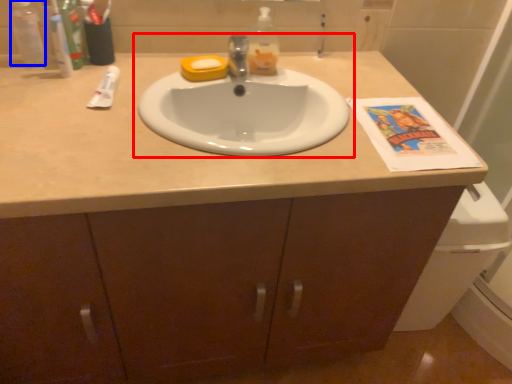
Question: Which of the following is the closest to the observer, sink (highlighted by a red box) or bottle (highlighted by a blue box)?

Choices:
 (A) sink
 (B) bottle

Answer: (A)